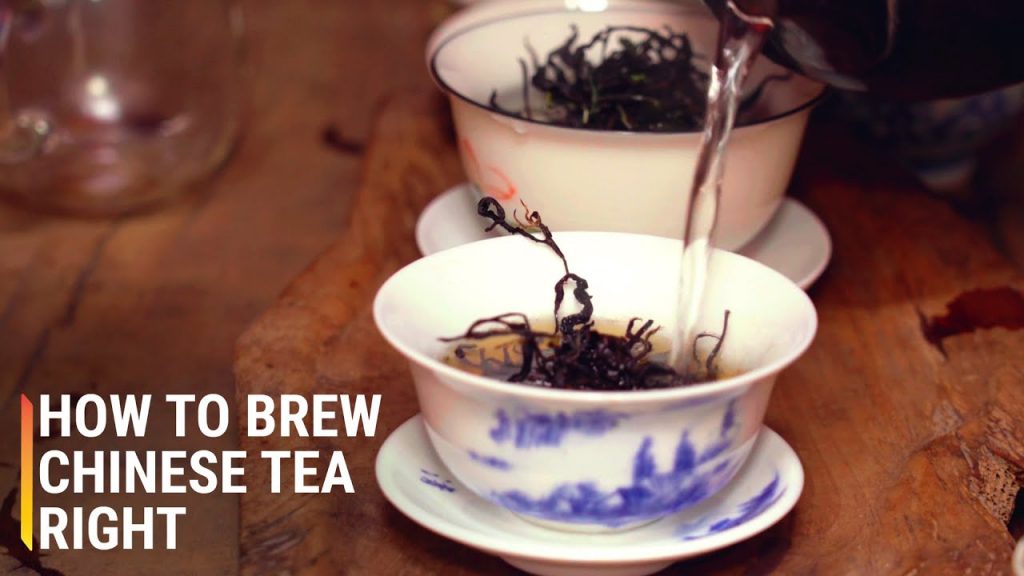
The image size is (1024, 576). I want to click on glass, so [156, 113].